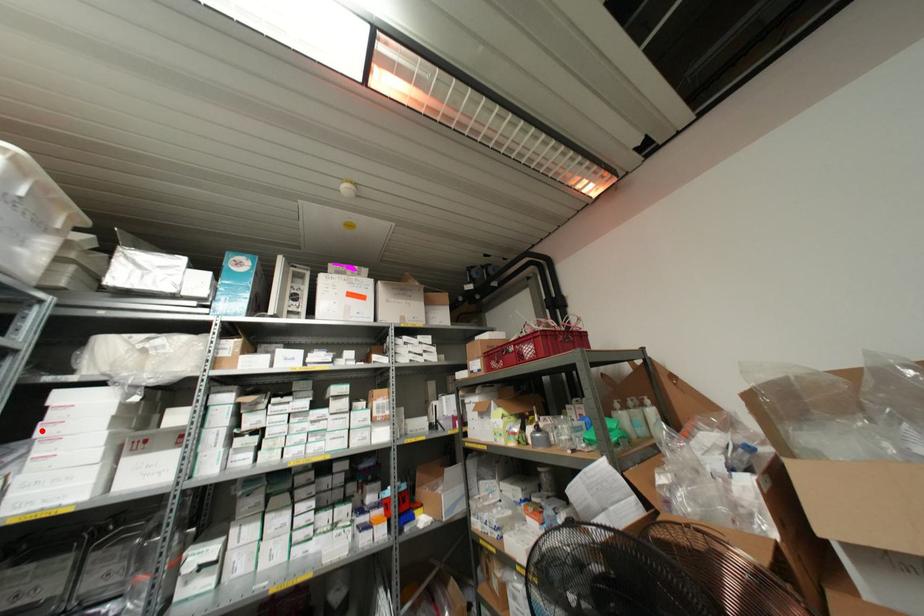
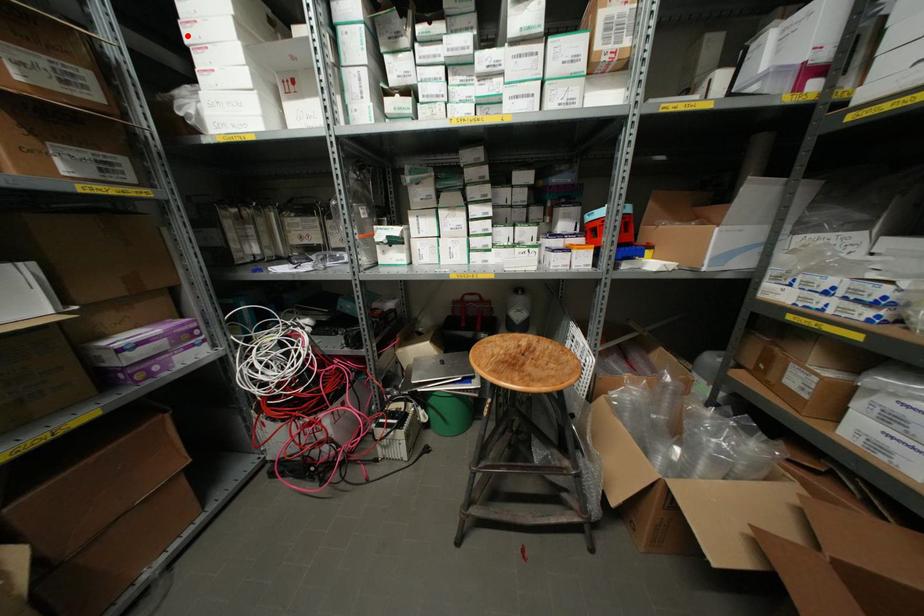
I am providing you with two images of the same scene from different viewpoints. A red point is marked on the first image and another point is marked on the second image. Is the marked point in image1 the same physical position as the marked point in image2?

Yes